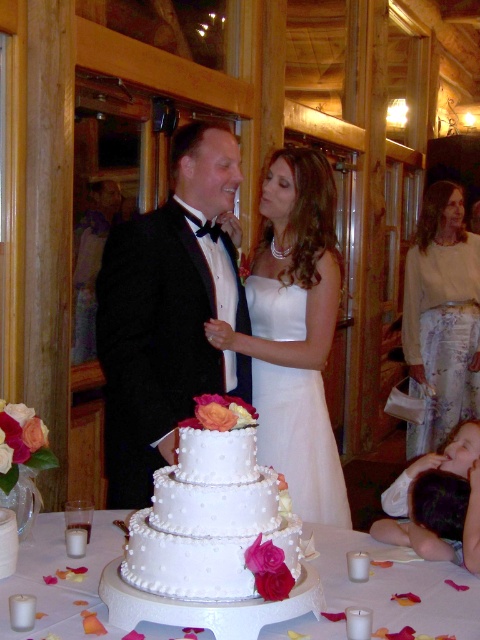
You are a photographer at the wedding and want to capture a photo of the white satin dress at center and the white textured cake at center. Which object is positioned higher in the image?

The white satin dress at center is above the white textured cake at center, so the white satin dress at center is positioned higher in the image.

You are a photographer at the wedding and want to capture a clear shot of both the white textured cake at center and the white satin wedding dress at center without any obstruction. Since the cake is in front of the dress, how should you adjust your position to ensure both are visible?

Since the white textured cake at center is in front of the white satin wedding dress at center, you should move to a position where you can angle your camera slightly downward to see both the cake and the dress. Alternatively, you might step back to create more depth so that both elements are visible without one blocking the other.